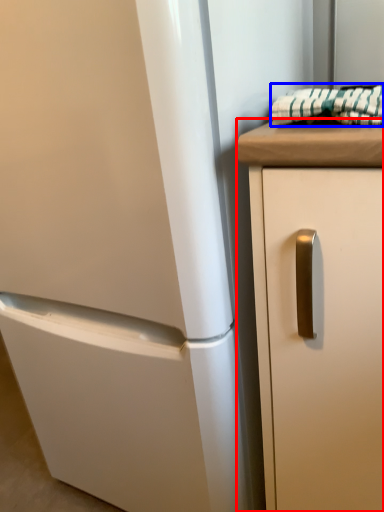
Question: Which object is closer to the camera taking this photo, cabinetry (highlighted by a red box) or blanket (highlighted by a blue box)?

Choices:
 (A) cabinetry
 (B) blanket

Answer: (A)